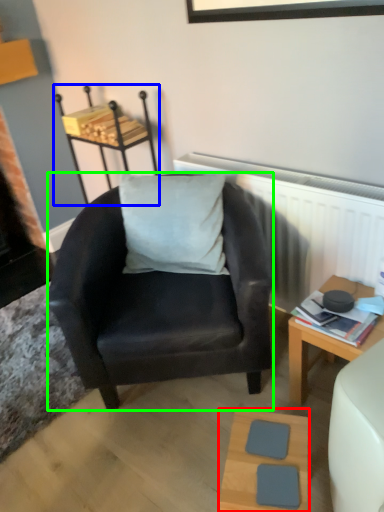
Question: Which object is positioned closest to table (highlighted by a red box)? Select from stool (highlighted by a blue box) and chair (highlighted by a green box).

Choices:
 (A) stool
 (B) chair

Answer: (B)